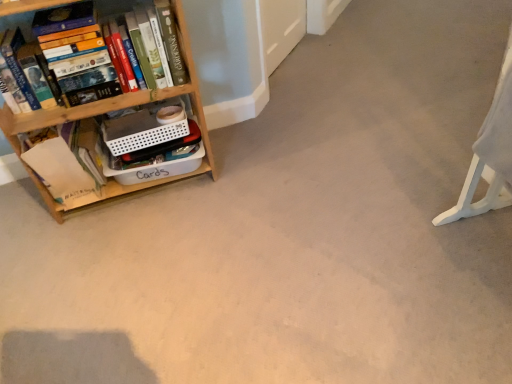
Identify the location of empty space that is ontop of hardcover book at left (from a real-world perspective). (95, 9).